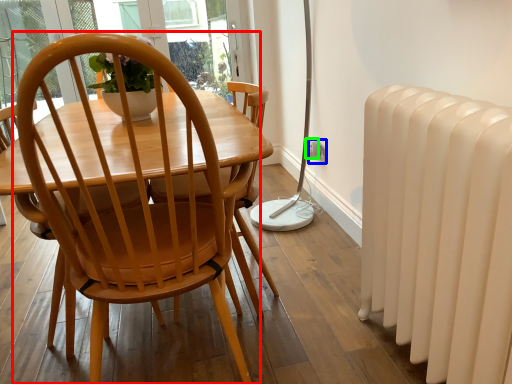
Question: Which object is the farthest from chair (highlighted by a red box)? Choose among these: power outlet (highlighted by a blue box) or electric outlet (highlighted by a green box).

Choices:
 (A) power outlet
 (B) electric outlet

Answer: (B)